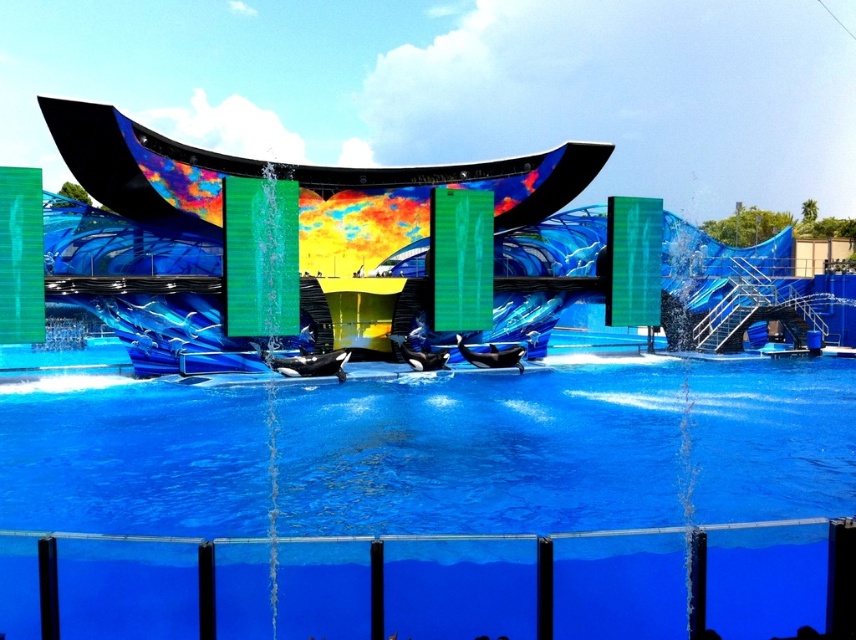
Question: Which point is farther from the camera taking this photo?

Choices:
 (A) (94, 248)
 (B) (771, 440)

Answer: (A)

Question: From the image, what is the correct spatial relationship of blue smooth water at center in relation to shiny metallic stage at center?

Choices:
 (A) above
 (B) below

Answer: (B)

Question: Which of the following is the closest to the observer?

Choices:
 (A) blue smooth water at center
 (B) shiny metallic stage at center

Answer: (A)

Question: Does blue smooth water at center appear on the left side of shiny metallic stage at center?

Choices:
 (A) no
 (B) yes

Answer: (B)

Question: Is blue smooth water at center to the left of shiny metallic stage at center from the viewer's perspective?

Choices:
 (A) no
 (B) yes

Answer: (B)